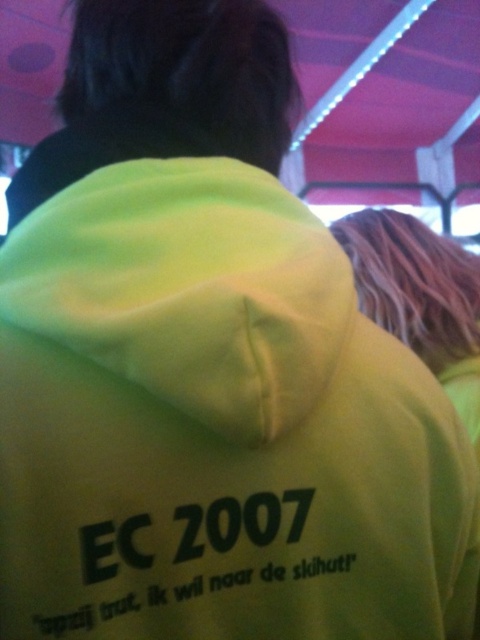
Question: Which point is closer to the camera?

Choices:
 (A) (432, 284)
 (B) (24, 132)

Answer: (A)

Question: Can you confirm if matte pink canopy at upper center is positioned to the right of neon yellow hoodie at upper right?

Choices:
 (A) no
 (B) yes

Answer: (B)

Question: Is matte pink canopy at upper center closer to the viewer compared to neon yellow hoodie at upper right?

Choices:
 (A) no
 (B) yes

Answer: (A)

Question: Can you confirm if matte pink canopy at upper center is positioned to the left of neon yellow hoodie at upper right?

Choices:
 (A) no
 (B) yes

Answer: (A)

Question: Which of the following is the closest to the observer?

Choices:
 (A) matte pink canopy at upper center
 (B) neon yellow hoodie at upper right

Answer: (B)